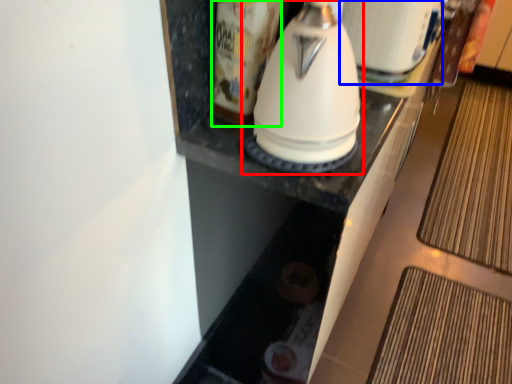
Question: Which is nearer to the kitchen appliance (highlighted by a red box)? appliance (highlighted by a blue box) or beverage (highlighted by a green box).

Choices:
 (A) appliance
 (B) beverage

Answer: (B)